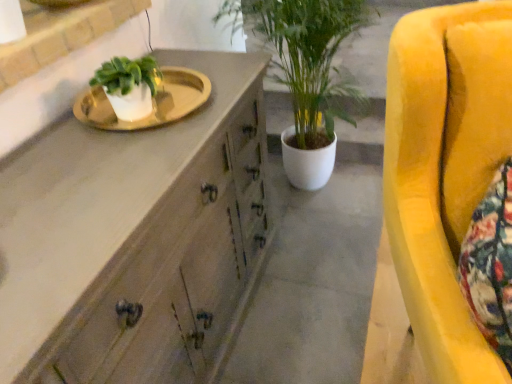
Question: Is white glossy sink at upper left facing towards velvet yellow armchair at right?

Choices:
 (A) no
 (B) yes

Answer: (B)

Question: From the image's perspective, is white glossy sink at upper left located above velvet yellow armchair at right?

Choices:
 (A) yes
 (B) no

Answer: (A)

Question: Is white glossy sink at upper left not near velvet yellow armchair at right?

Choices:
 (A) yes
 (B) no

Answer: (B)

Question: Can velvet yellow armchair at right be found inside white glossy sink at upper left?

Choices:
 (A) no
 (B) yes

Answer: (A)

Question: From a real-world perspective, is white glossy sink at upper left positioned under velvet yellow armchair at right based on gravity?

Choices:
 (A) yes
 (B) no

Answer: (B)

Question: Considering the relative positions of white glossy sink at upper left and velvet yellow armchair at right in the image provided, is white glossy sink at upper left in front of velvet yellow armchair at right?

Choices:
 (A) yes
 (B) no

Answer: (B)

Question: From a real-world perspective, is wooden cabinet at center on top of concreteroughcabinet at center?

Choices:
 (A) yes
 (B) no

Answer: (A)

Question: Is wooden cabinet at center touching concreteroughcabinet at center?

Choices:
 (A) no
 (B) yes

Answer: (A)

Question: From the image's perspective, is wooden cabinet at center located above concreteroughcabinet at center?

Choices:
 (A) no
 (B) yes

Answer: (B)

Question: Does wooden cabinet at center have a larger size compared to concreteroughcabinet at center?

Choices:
 (A) yes
 (B) no

Answer: (A)

Question: Can we say wooden cabinet at center lies outside concreteroughcabinet at center?

Choices:
 (A) yes
 (B) no

Answer: (A)

Question: Considering the relative sizes of wooden cabinet at center and concreteroughcabinet at center in the image provided, is wooden cabinet at center shorter than concreteroughcabinet at center?

Choices:
 (A) no
 (B) yes

Answer: (A)

Question: Is concreteroughcabinet at center positioned far away from wooden cabinet at center?

Choices:
 (A) yes
 (B) no

Answer: (B)